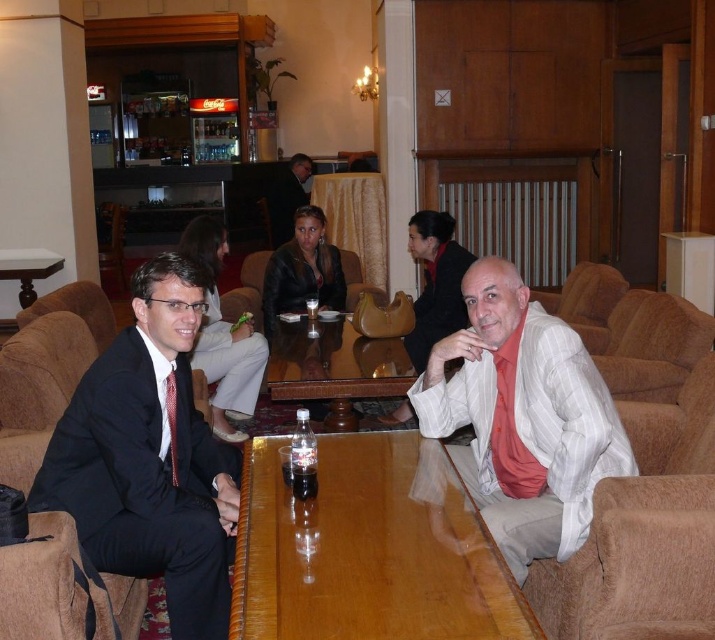
Question: Among these objects, which one is nearest to the camera?

Choices:
 (A) dark brown leather jacket at center
 (B) patterned silk tie at left
 (C) black plastic bottle at center
 (D) beige plush armchair at right

Answer: (D)

Question: Can you confirm if patterned silk tie at left is positioned below black plastic bottle at center?

Choices:
 (A) no
 (B) yes

Answer: (A)

Question: Which object is closer to the camera taking this photo?

Choices:
 (A) patterned silk tie at left
 (B) dark brown leather jacket at center

Answer: (A)

Question: Does white glossy table at left come behind black plastic bottle at center?

Choices:
 (A) no
 (B) yes

Answer: (B)

Question: Does wooden polished table at center come in front of matte black suit at left?

Choices:
 (A) no
 (B) yes

Answer: (B)

Question: Which of the following is the farthest from the observer?

Choices:
 (A) leather jacket at center
 (B) white striped shirt at center
 (C) patterned silk tie at left

Answer: (A)